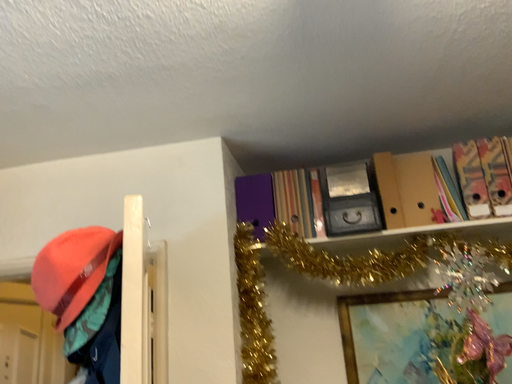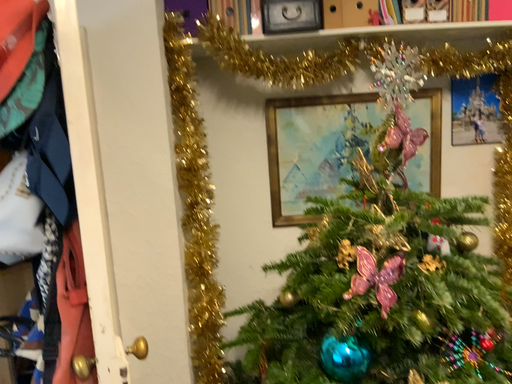
Question: Which way did the camera rotate in the video?

Choices:
 (A) rotated upward
 (B) rotated downward

Answer: (B)